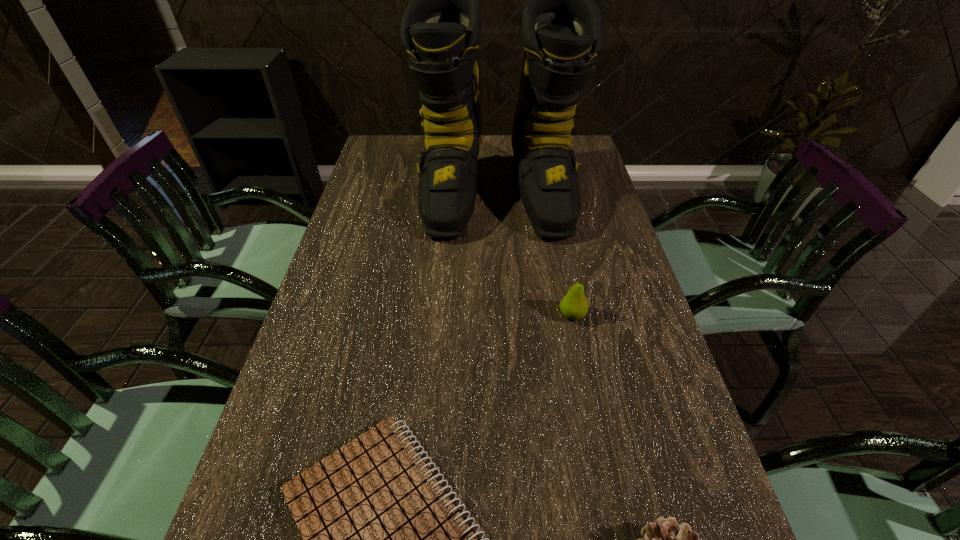
The width and height of the screenshot is (960, 540). Identify the location of free space at the far edge of the desktop. [x=489, y=135].

In order to click on free space at the left edge of the desktop in this screenshot , I will do `click(388, 258)`.

Where is `free space at the right edge of the desktop`? The width and height of the screenshot is (960, 540). free space at the right edge of the desktop is located at coordinates (611, 210).

In the image, there is a desktop. Identify the location of vacant space at the far left corner. The image size is (960, 540). (379, 152).

Identify the location of free spot between the second farthest object and the ski boots. (535, 256).

Find the location of a particular element. This screenshot has height=540, width=960. empty space between the third nearest object and the farthest object is located at coordinates (535, 256).

The height and width of the screenshot is (540, 960). I want to click on object identified as the second closest to the second shortest object, so click(574, 305).

Locate which object is the second closest to the notebook. Please provide its 2D coordinates. Your answer should be formatted as a tuple, i.e. [(x, y)], where the tuple contains the x and y coordinates of a point satisfying the conditions above.

[(574, 305)]